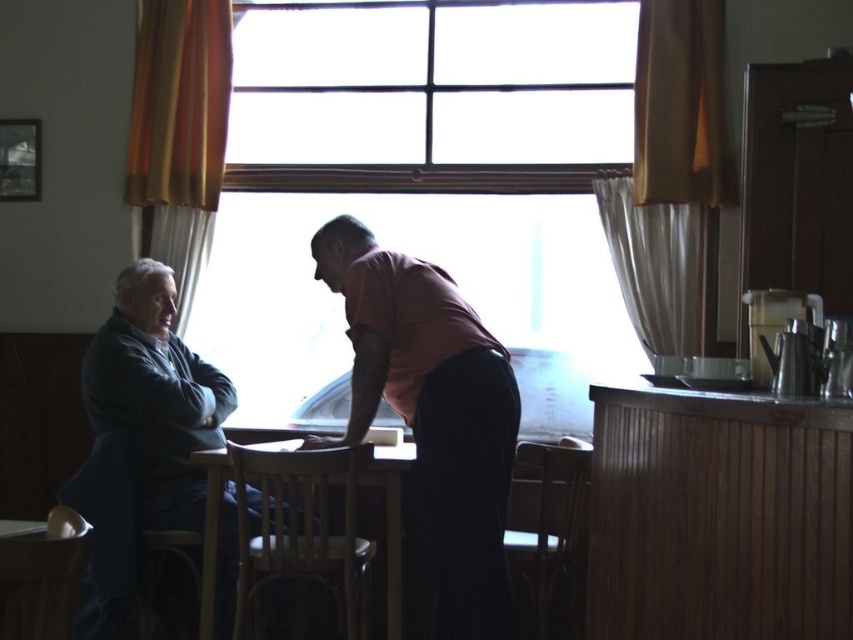
Can you confirm if dark blue sweater at left is shorter than wooden table at center?

No, dark blue sweater at left is not shorter than wooden table at center.

Can you confirm if dark blue sweater at left is bigger than wooden table at center?

Correct, dark blue sweater at left is larger in size than wooden table at center.

This screenshot has height=640, width=853. Describe the element at coordinates (155, 396) in the screenshot. I see `dark blue sweater at left` at that location.

Locate an element on the screen. This screenshot has height=640, width=853. dark blue sweater at left is located at coordinates (155, 396).

Which of these two, dark gray sweater at left or dark blue sweater at left, stands taller?

dark gray sweater at left is taller.

Consider the image. Does dark gray sweater at left appear on the left side of dark blue sweater at left?

No, dark gray sweater at left is not to the left of dark blue sweater at left.

Is point (463, 419) positioned behind point (221, 404)?

No, (463, 419) is in front of (221, 404).

This screenshot has height=640, width=853. What are the coordinates of `dark gray sweater at left` in the screenshot? It's located at (431, 420).

Is the position of dark gray sweater at left less distant than that of matte pink shirt at center?

No, dark gray sweater at left is behind matte pink shirt at center.

Which is above, dark gray sweater at left or matte pink shirt at center?

matte pink shirt at center

Does point (341, 445) come closer to viewer compared to point (422, 547)?

That is True.

The height and width of the screenshot is (640, 853). Identify the location of dark gray sweater at left. (431, 420).